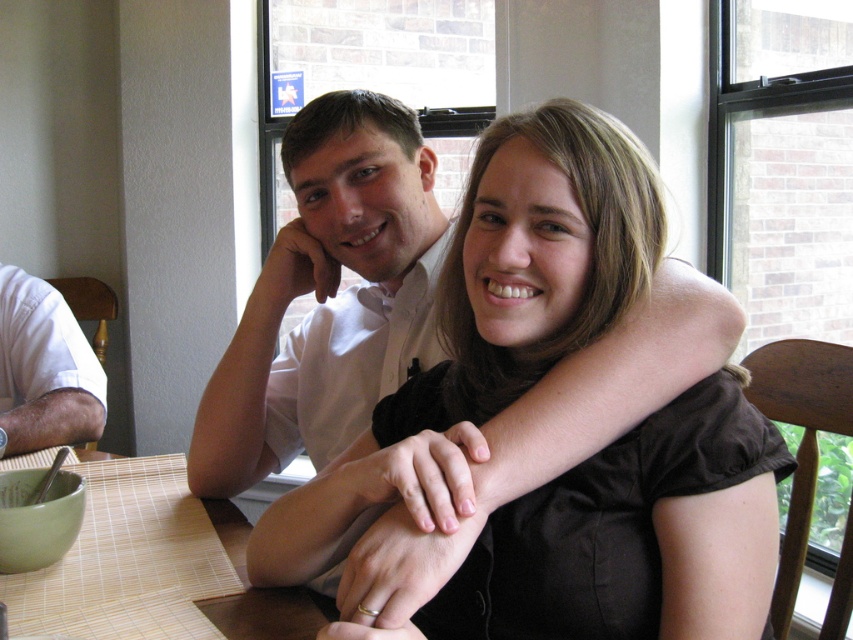
You are a photographer setting up for a portrait. You notice the bamboo placemat at lower left and the white cotton shirt at left in the scene. Which object is shorter in height?

The bamboo placemat at lower left is not as tall as the white cotton shirt at left, so the bamboo placemat at lower left is shorter in height.

You are a photographer setting up for a portrait session in this dining area. You need to ensure that the black satin blouse at upper center and the bamboo placemat at lower left are both visible in the shot. Based on their positions, which object should you focus on first to capture both in frame?

The black satin blouse at upper center is located above the bamboo placemat at lower left. To capture both in frame, you should focus on the black satin blouse at upper center first as it is higher up, allowing the placemat to be included below.

You are a photographer standing at the entrance of the room. You need to take a photo of the two people seated at the table. The camera you are using has a limited field of view and can only capture objects within a 0.5 meter radius from the center point. The center point of your camera is currently set to the point at coordinates point (154, 566). Will the two people seated at the table be fully visible in the photo?

The point (154, 566) is on bamboo placemat at lower left. Since the two people are seated at the table and the placemat is at the lower left, the center point of the camera is focused on the lower left area. The camera can only capture objects within a 0.5 meter radius from this point. Depending on the distance between the photographer and the table, the field of view might not be sufficient to include both individuals fully. However, the description does not provide exact distances between the placemat,